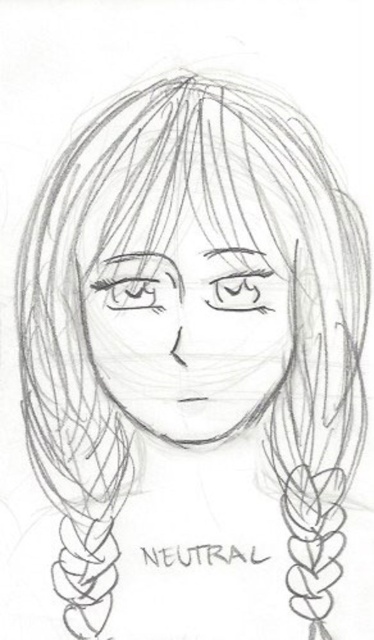
Question: Which point appears farthest from the camera in this image?

Choices:
 (A) (105, 333)
 (B) (247, 294)

Answer: (B)

Question: Is matte pencil eye at upper center thinner than pencil sketch eye at center?

Choices:
 (A) yes
 (B) no

Answer: (A)

Question: Observing the image, what is the correct spatial positioning of pencil sketch face at center in reference to pencil sketch eye at center?

Choices:
 (A) below
 (B) above

Answer: (A)

Question: From the image, what is the correct spatial relationship of pencil sketch face at center in relation to matte pencil eye at upper center?

Choices:
 (A) below
 (B) above

Answer: (A)

Question: Which of the following is the closest to the observer?

Choices:
 (A) (129, 292)
 (B) (276, 294)
 (C) (240, 289)

Answer: (B)

Question: Which object appears closest to the camera in this image?

Choices:
 (A) pencil sketch face at center
 (B) pencil sketch eye at center
 (C) matte pencil eye at upper center

Answer: (A)